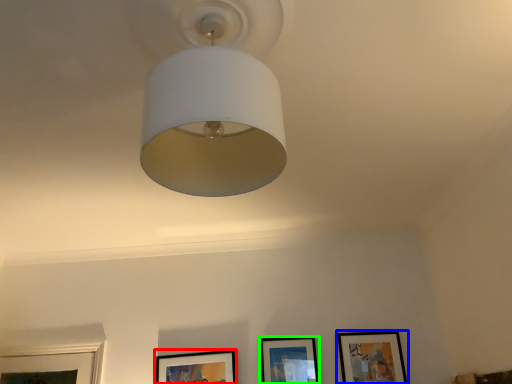
Question: Estimate the real-world distances between objects in this image. Which object is closer to picture frame (highlighted by a red box), picture frame (highlighted by a blue box) or picture frame (highlighted by a green box)?

Choices:
 (A) picture frame
 (B) picture frame

Answer: (B)